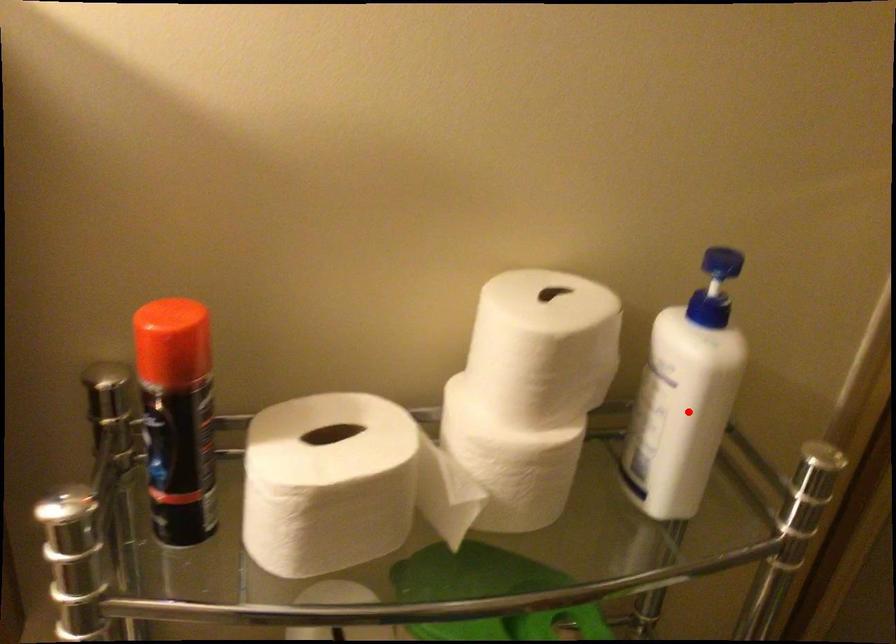
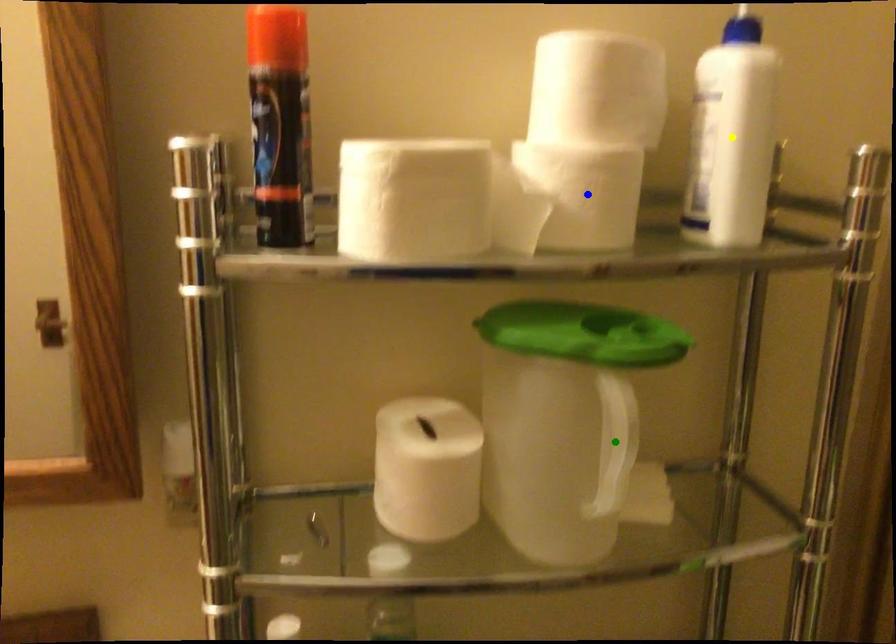
Question: I am providing you with two images of the same scene from different viewpoints. A red point is marked on the first image. You are given multiple points on the second image. Which spot in image 2 lines up with the point in image 1?

Choices:
 (A) blue point
 (B) green point
 (C) yellow point

Answer: (C)